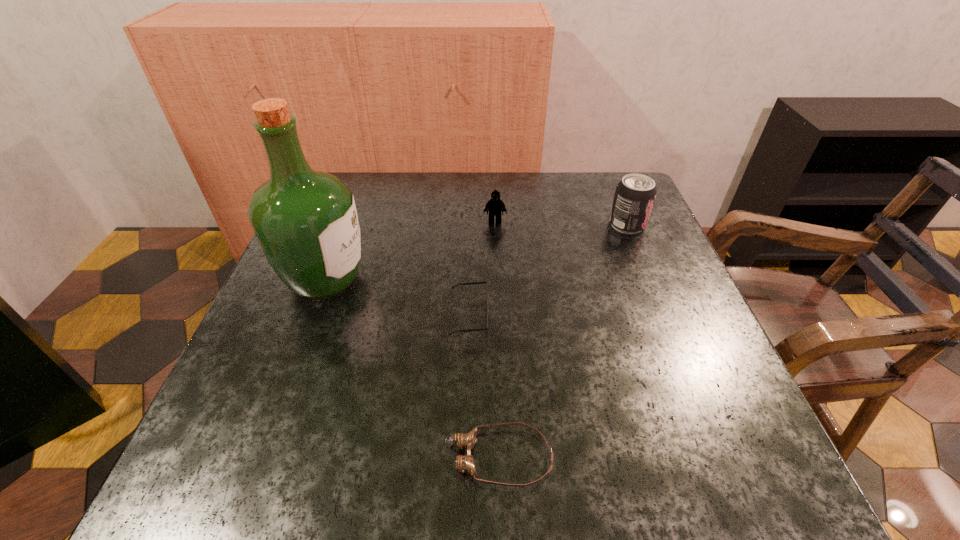
This screenshot has height=540, width=960. I want to click on the tallest object, so click(305, 220).

At what (x,y) coordinates should I click in order to perform the action: click on liquor. Please return your answer as a coordinate pair (x, y). The width and height of the screenshot is (960, 540). Looking at the image, I should click on (305, 220).

Locate an element on the screen. the second tallest object is located at coordinates (634, 197).

Find the location of a particular element. The height and width of the screenshot is (540, 960). soda can is located at coordinates (634, 197).

You are a GUI agent. You are given a task and a screenshot of the screen. Output one action in this format:
    pyautogui.click(x=<x>, y=<y>)
    Task: Click on the third tallest object
    The image size is (960, 540).
    Given the screenshot: What is the action you would take?
    pyautogui.click(x=494, y=205)

The image size is (960, 540). I want to click on the fourth tallest object, so click(x=470, y=283).

Find the location of `the shortest object`. the shortest object is located at coordinates (464, 463).

Locate an element on the screen. This screenshot has height=540, width=960. goggles is located at coordinates (464, 463).

The image size is (960, 540). What are the coordinates of `vacant area situated on the front-facing side of the leftmost object` in the screenshot? It's located at (426, 279).

Find the location of a particular element. The height and width of the screenshot is (540, 960). vacant space located 0.260m on the left of the rightmost object is located at coordinates (503, 225).